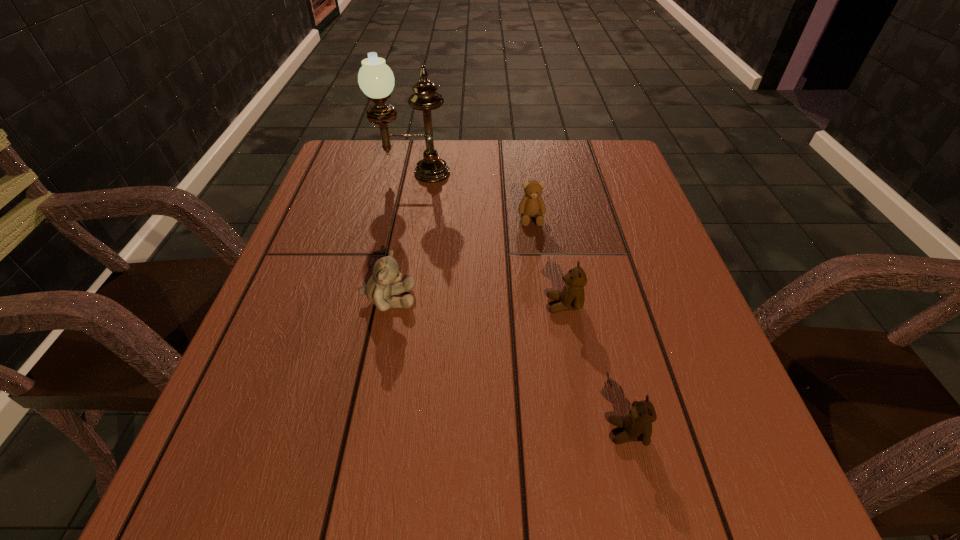
You are a GUI agent. You are given a task and a screenshot of the screen. Output one action in this format:
    pyautogui.click(x=<x>, y=<y>)
    Task: Click on the oil lamp
    Image resolution: width=960 pixels, height=540 pixels.
    Given the screenshot: What is the action you would take?
    pyautogui.click(x=375, y=78)

What are the coordinates of `the tallest object` in the screenshot? It's located at (375, 78).

Locate an element on the screen. This screenshot has width=960, height=540. the leftmost teddy bear is located at coordinates (384, 282).

At what (x,y) coordinates should I click in order to perform the action: click on the second farthest object. Please return your answer as a coordinate pair (x, y). The image size is (960, 540). Looking at the image, I should click on (532, 204).

This screenshot has height=540, width=960. I want to click on the nearest object, so click(637, 425).

At what (x,y) coordinates should I click in order to perform the action: click on the nearest teddy bear. Please return your answer as a coordinate pair (x, y). This screenshot has width=960, height=540. Looking at the image, I should click on (637, 425).

Locate an element on the screen. free space located on the front of the tallest object is located at coordinates 407,204.

The height and width of the screenshot is (540, 960). Find the location of `free spot located on the face of the leftmost teddy bear`. free spot located on the face of the leftmost teddy bear is located at coordinates (525, 299).

The height and width of the screenshot is (540, 960). I want to click on vacant space positioned 0.280m on the face of the second farthest object, so click(x=545, y=322).

You are a GUI agent. You are given a task and a screenshot of the screen. Output one action in this format:
    pyautogui.click(x=<x>, y=<y>)
    Task: Click on the vacant position located 0.360m at the face of the nearest teddy bear
    
    Given the screenshot: What is the action you would take?
    pyautogui.click(x=370, y=432)